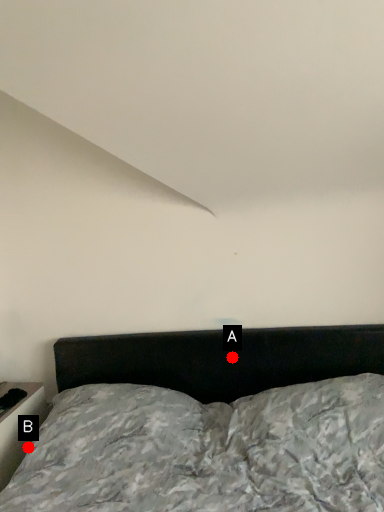
Question: Two points are circled on the image, labeled by A and B beside each circle. Which point appears farthest from the camera in this image?

Choices:
 (A) A is further
 (B) B is further

Answer: (A)